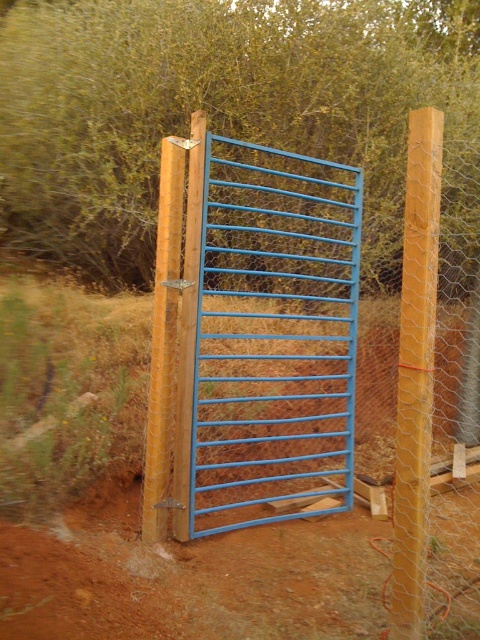
Question: Is dirt field at center positioned at the back of blue painted metal gate at center?

Choices:
 (A) no
 (B) yes

Answer: (A)

Question: Does dirt field at center have a larger size compared to blue painted metal gate at center?

Choices:
 (A) yes
 (B) no

Answer: (A)

Question: Is dirt field at center in front of blue painted metal gate at center?

Choices:
 (A) yes
 (B) no

Answer: (A)

Question: Which point is farther to the camera?

Choices:
 (A) (224, 172)
 (B) (105, 358)

Answer: (A)